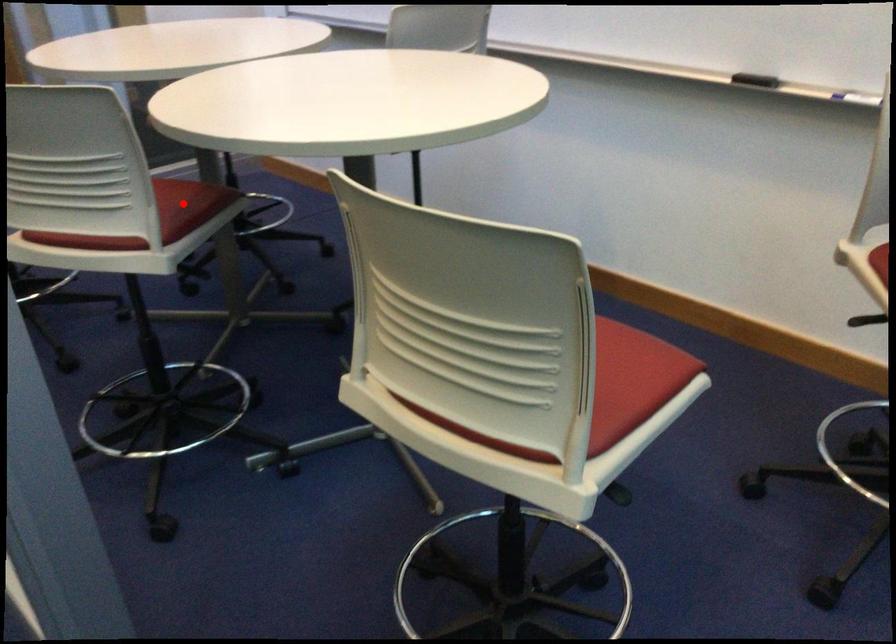
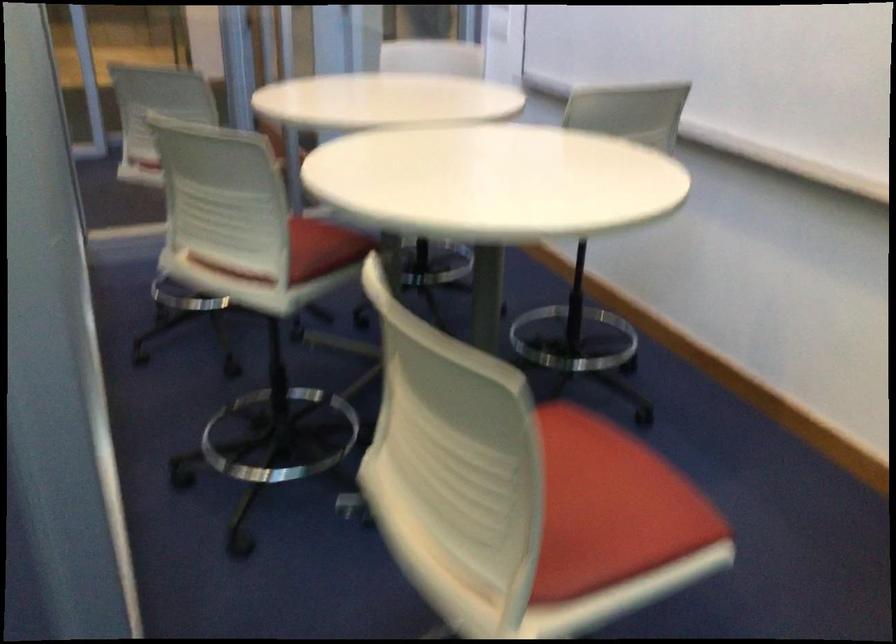
In the second image, find the point that corresponds to the highlighted location in the first image.

(322, 249)